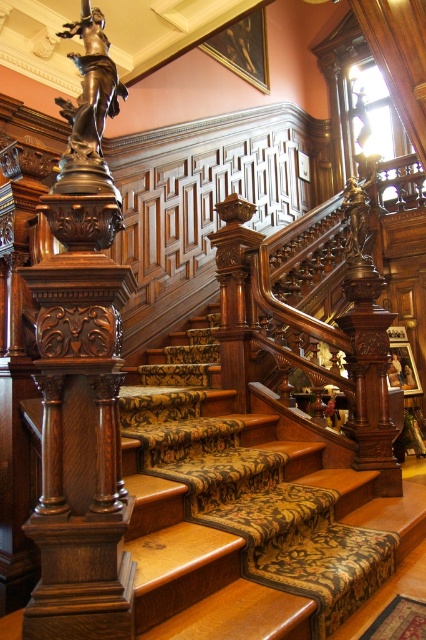
Does bronze/carved wood pillar at left have a lesser width compared to bronze statue at upper left?

No, bronze/carved wood pillar at left is not thinner than bronze statue at upper left.

The height and width of the screenshot is (640, 426). In order to click on bronze/carved wood pillar at left in this screenshot , I will do `click(81, 376)`.

Between point (60, 460) and point (63, 116), which one is positioned in front?

Point (60, 460) is more forward.

The width and height of the screenshot is (426, 640). What are the coordinates of `bronze/carved wood pillar at left` in the screenshot? It's located at (81, 376).